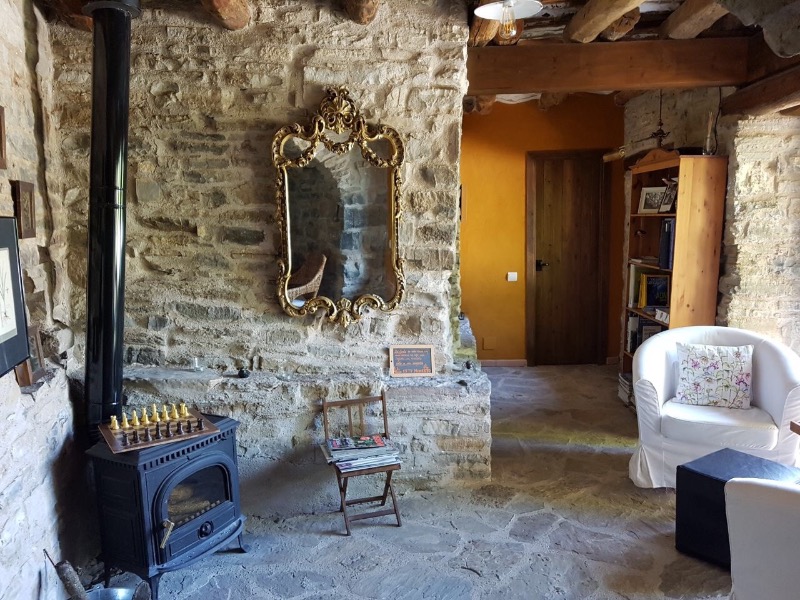
At what (x,y) coordinates should I click in order to perform the action: click on chess board. Please return your answer as a coordinate pair (x, y). The image size is (800, 600). Looking at the image, I should click on (150, 429).